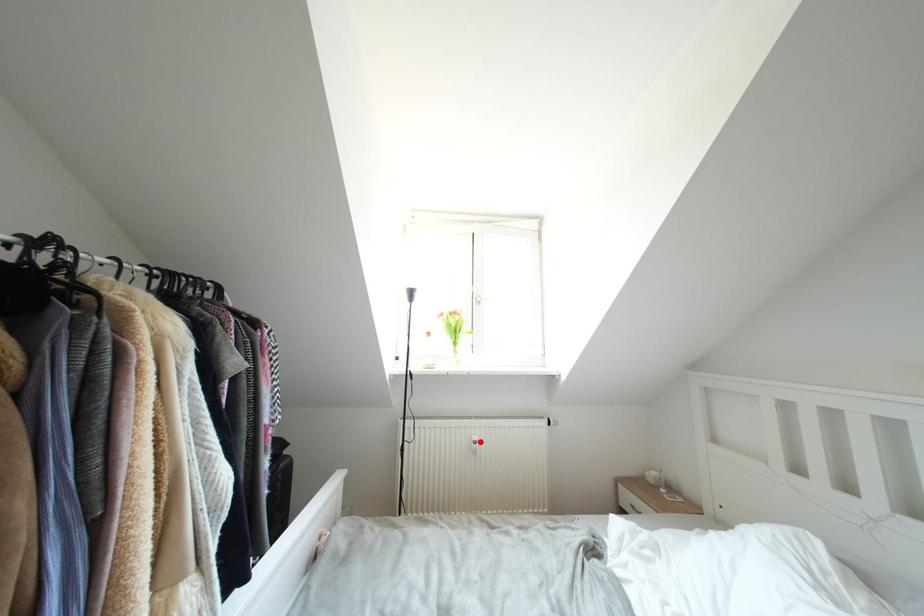
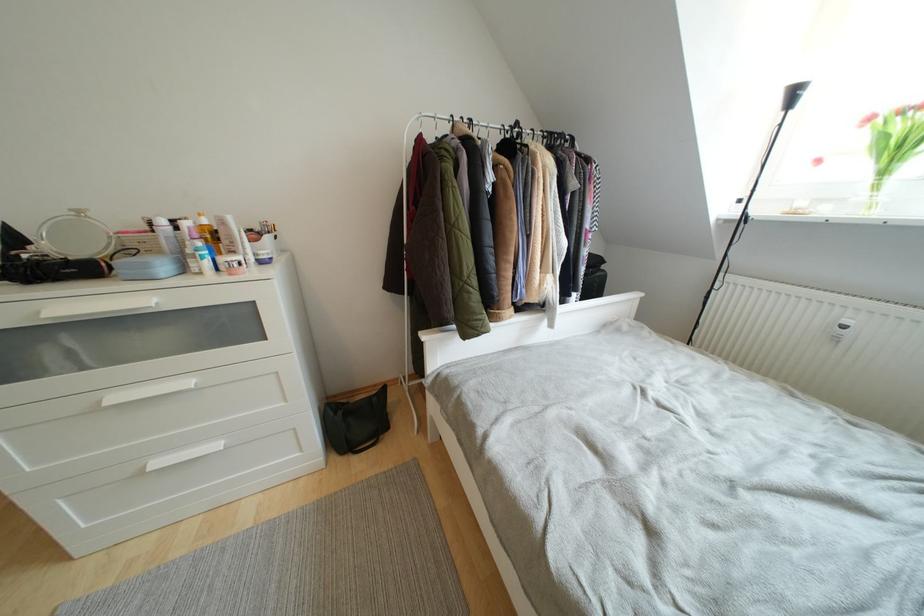
Where in the second image is the point corresponding to the highlighted location from the first image?

(853, 326)